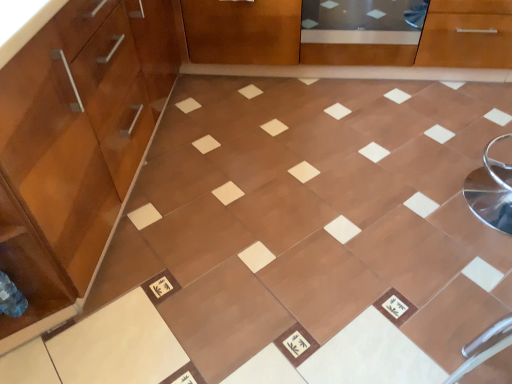
Question: In which direction should I rotate to look at transparent glass screen door at upper center?

Choices:
 (A) left
 (B) right

Answer: (B)

Question: Is brown glossy tile at center placed right next to matte wood cabinetry at left?

Choices:
 (A) no
 (B) yes

Answer: (A)

Question: From a real-world perspective, is brown glossy tile at center over matte wood cabinetry at left?

Choices:
 (A) no
 (B) yes

Answer: (A)

Question: Is brown glossy tile at center bigger than matte wood cabinetry at left?

Choices:
 (A) no
 (B) yes

Answer: (A)

Question: Is brown glossy tile at center at the right side of matte wood cabinetry at left?

Choices:
 (A) no
 (B) yes

Answer: (B)

Question: From the image's perspective, is brown glossy tile at center located beneath matte wood cabinetry at left?

Choices:
 (A) yes
 (B) no

Answer: (A)

Question: Would you say brown glossy tile at center contains matte wood cabinetry at left?

Choices:
 (A) yes
 (B) no

Answer: (B)

Question: Does brown glossy tile at center have a larger size compared to transparent glass screen door at upper center?

Choices:
 (A) no
 (B) yes

Answer: (B)

Question: Does brown glossy tile at center have a lesser width compared to transparent glass screen door at upper center?

Choices:
 (A) no
 (B) yes

Answer: (A)

Question: Does brown glossy tile at center appear on the left side of transparent glass screen door at upper center?

Choices:
 (A) no
 (B) yes

Answer: (B)

Question: Is brown glossy tile at center far away from transparent glass screen door at upper center?

Choices:
 (A) no
 (B) yes

Answer: (A)

Question: Considering the relative sizes of brown glossy tile at center and transparent glass screen door at upper center in the image provided, is brown glossy tile at center smaller than transparent glass screen door at upper center?

Choices:
 (A) no
 (B) yes

Answer: (A)

Question: Are brown glossy tile at center and transparent glass screen door at upper center beside each other?

Choices:
 (A) no
 (B) yes

Answer: (A)

Question: From a real-world perspective, is transparent glass screen door at upper center on top of matte wood cabinetry at left?

Choices:
 (A) no
 (B) yes

Answer: (A)